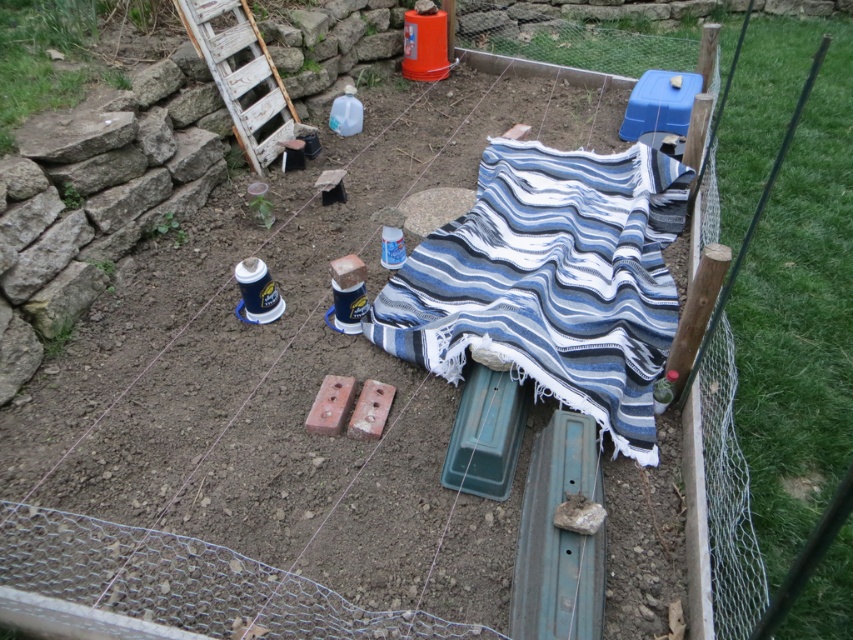
Question: Which point is closer to the camera?

Choices:
 (A) (221, 0)
 (B) (645, 352)

Answer: (B)

Question: Which of the following is the closest to the observer?

Choices:
 (A) blue striped fabric at center
 (B) white weathered wood ladder at upper left

Answer: (A)

Question: Does blue striped fabric at center come behind white weathered wood ladder at upper left?

Choices:
 (A) yes
 (B) no

Answer: (B)

Question: Is blue striped fabric at center thinner than white weathered wood ladder at upper left?

Choices:
 (A) yes
 (B) no

Answer: (B)

Question: Can you confirm if blue striped fabric at center is bigger than white weathered wood ladder at upper left?

Choices:
 (A) no
 (B) yes

Answer: (B)